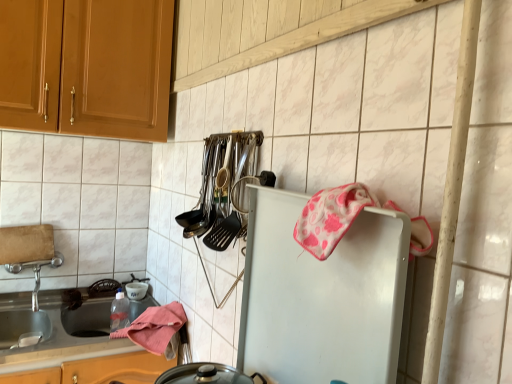
Question: Is polished stainless steel utensils at center oriented away from pink fabric towel at lower left, which is the second material in front-to-back order?

Choices:
 (A) yes
 (B) no

Answer: (B)

Question: Is polished stainless steel utensils at center outside of pink fabric towel at lower left, which is the second material in front-to-back order?

Choices:
 (A) yes
 (B) no

Answer: (A)

Question: Is polished stainless steel utensils at center directly adjacent to pink fabric towel at lower left, placed as the second material when sorted from top to bottom?

Choices:
 (A) yes
 (B) no

Answer: (B)

Question: Can you confirm if polished stainless steel utensils at center is shorter than pink fabric towel at lower left, placed as the second material when sorted from top to bottom?

Choices:
 (A) yes
 (B) no

Answer: (B)

Question: From the image's perspective, does polished stainless steel utensils at center appear lower than pink fabric towel at lower left, the first material when ordered from left to right?

Choices:
 (A) yes
 (B) no

Answer: (B)

Question: Would you say pink fabric towel at lower left, the 1th material ordered from the bottom, is to the left or to the right of pink fabric towel at upper right, the second material in the bottom-to-top sequence, in the picture?

Choices:
 (A) left
 (B) right

Answer: (A)

Question: Is pink fabric towel at lower left, which is the second material in front-to-back order, taller or shorter than pink fabric towel at upper right, acting as the 1th material starting from the right?

Choices:
 (A) short
 (B) tall

Answer: (B)

Question: From a real-world perspective, is pink fabric towel at lower left, which ranks as the first material in back-to-front order, physically located above or below pink fabric towel at upper right, which is the first material in top-to-bottom order?

Choices:
 (A) above
 (B) below

Answer: (B)

Question: Is pink fabric towel at lower left, the first material when ordered from left to right, wider or thinner than pink fabric towel at upper right, which is the first material in top-to-bottom order?

Choices:
 (A) thin
 (B) wide

Answer: (B)

Question: From a real-world perspective, is pink fabric towel at lower left, which appears as the second material when viewed from the right, above or below polished stainless steel utensils at center?

Choices:
 (A) below
 (B) above

Answer: (A)

Question: In the image, is pink fabric towel at lower left, which appears as the second material when viewed from the right, positioned in front of or behind polished stainless steel utensils at center?

Choices:
 (A) front
 (B) behind

Answer: (B)

Question: In terms of size, does pink fabric towel at lower left, which is the second material in front-to-back order, appear bigger or smaller than polished stainless steel utensils at center?

Choices:
 (A) big
 (B) small

Answer: (A)

Question: Is point (184, 314) closer or farther from the camera than point (251, 132)?

Choices:
 (A) farther
 (B) closer

Answer: (A)

Question: In the image, is polished stainless steel utensils at center positioned in front of or behind white matte refrigerator at center-right?

Choices:
 (A) behind
 (B) front

Answer: (A)

Question: Does point (219, 155) appear closer or farther from the camera than point (284, 236)?

Choices:
 (A) farther
 (B) closer

Answer: (A)